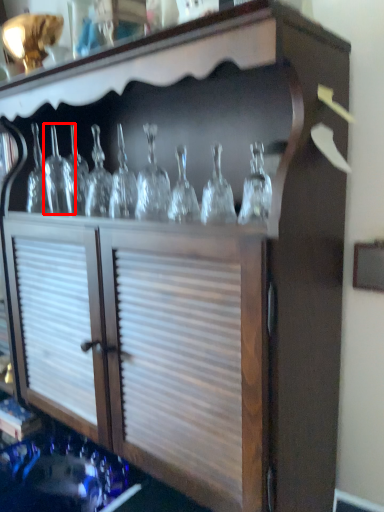
Question: From the image's perspective, what is the correct spatial relationship of glass bottle (annotated by the red box) in relation to glass bottle?

Choices:
 (A) below
 (B) above

Answer: (B)